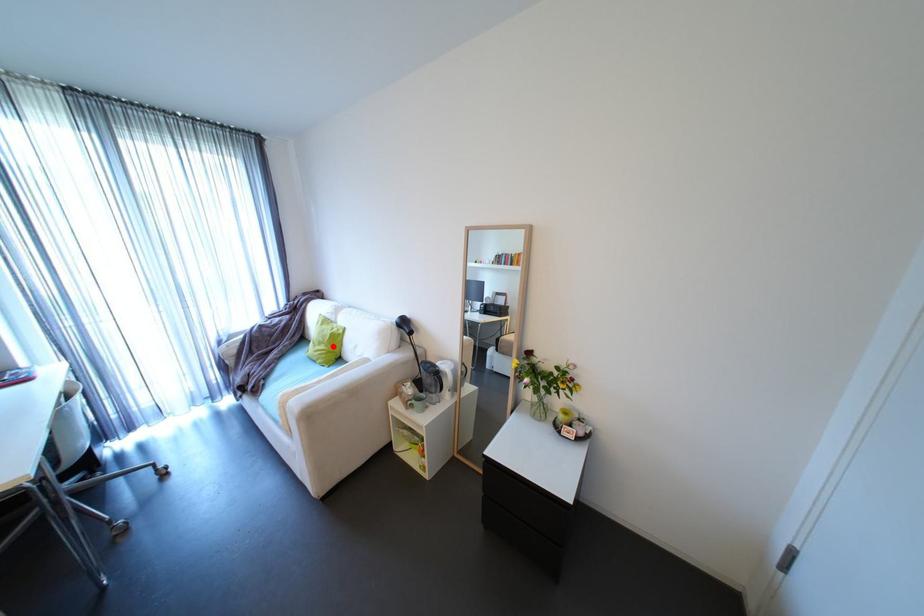
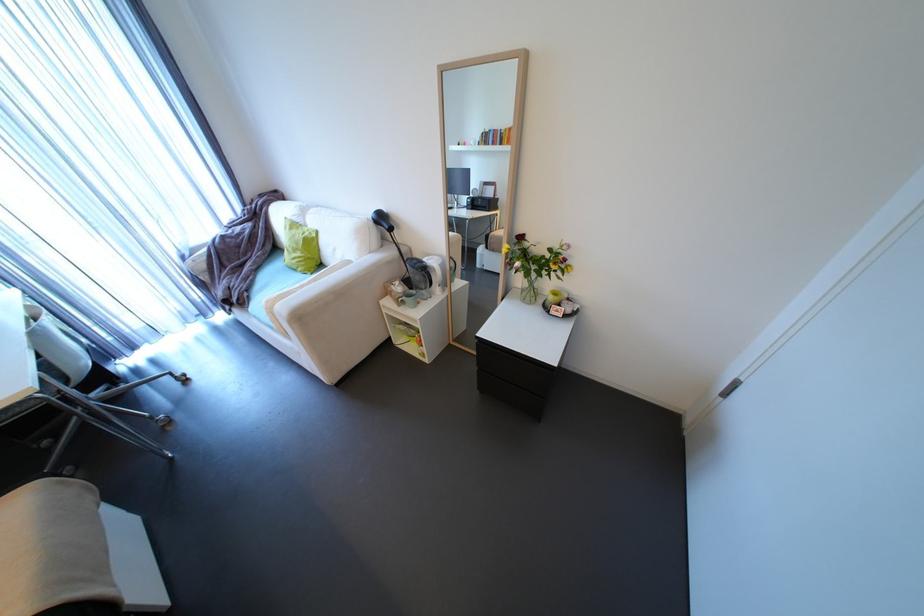
Question: I am providing you with two images of the same scene from different viewpoints. In image1, a red point is highlighted. Considering the same 3D point in image2, which of the following is correct?

Choices:
 (A) It is closer
 (B) It is farther

Answer: (A)